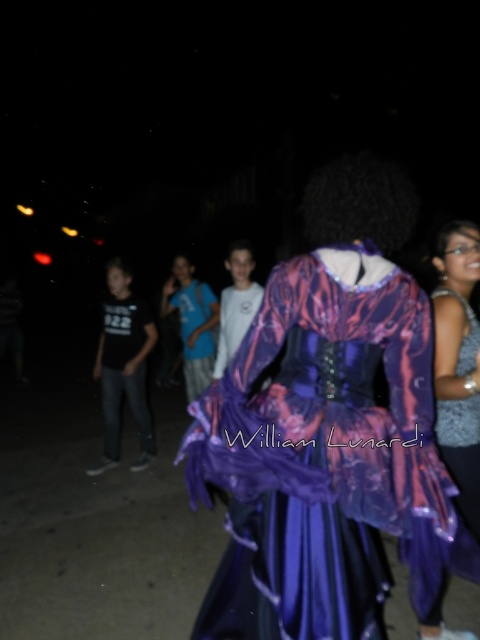
Question: Is shiny purple dress at center wider than purple satin robe at center?

Choices:
 (A) no
 (B) yes

Answer: (B)

Question: Estimate the real-world distances between objects in this image. Which object is farther from the purple satin robe at center?

Choices:
 (A) shiny purple dress at center
 (B) shiny purple dress at right

Answer: (A)

Question: Can you confirm if shiny purple dress at center is positioned below purple satin robe at left?

Choices:
 (A) no
 (B) yes

Answer: (B)

Question: Which object is farther from the camera taking this photo?

Choices:
 (A) shiny purple dress at right
 (B) purple satin robe at left
 (C) shiny purple dress at center
 (D) purple satin robe at center

Answer: (D)

Question: Which point is farther to the camera?

Choices:
 (A) purple satin robe at center
 (B) shiny purple dress at right
 (C) purple satin robe at left
 (D) shiny purple dress at center

Answer: (A)

Question: Is shiny purple dress at right positioned behind purple satin robe at left?

Choices:
 (A) yes
 (B) no

Answer: (B)